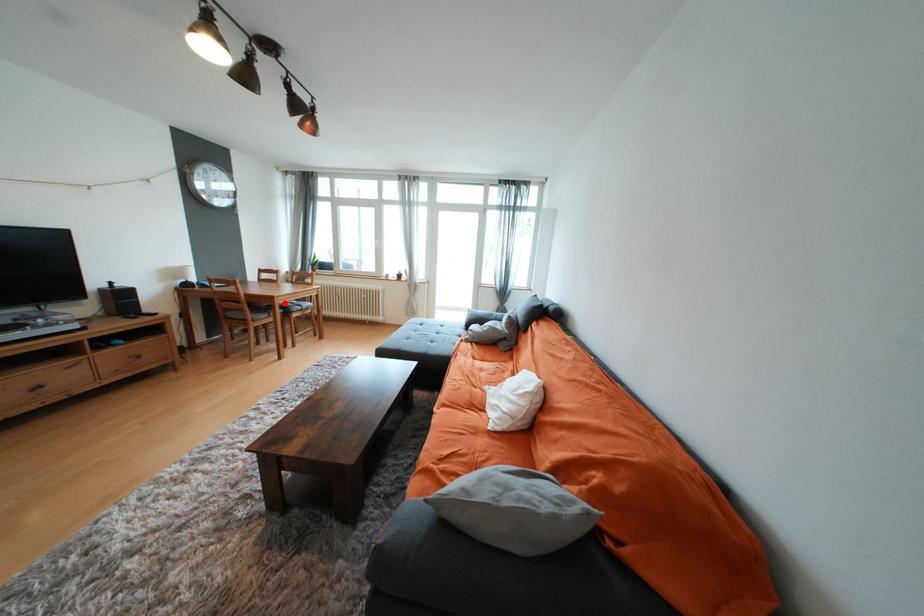
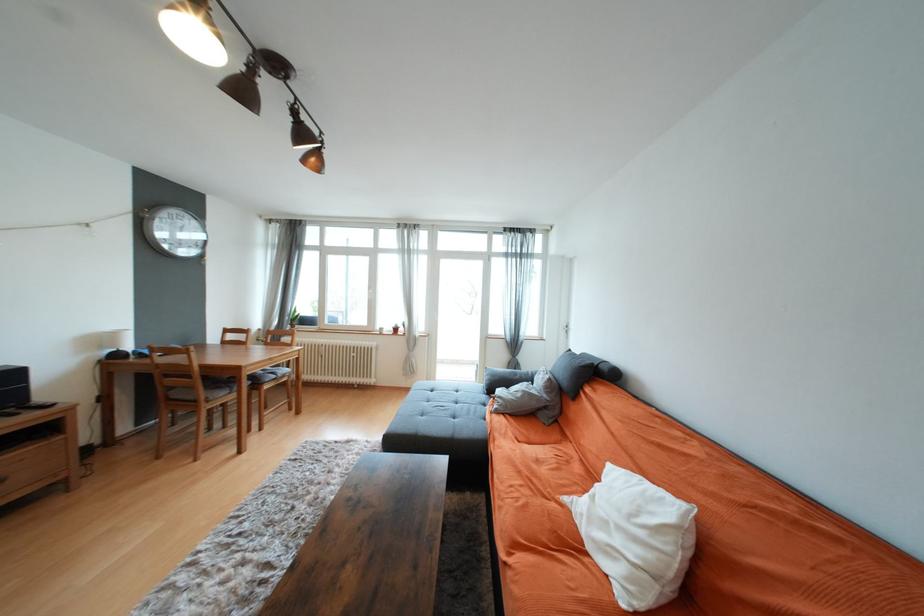
The point at the highlighted location is marked in the first image. Where is the corresponding point in the second image?

(253, 374)